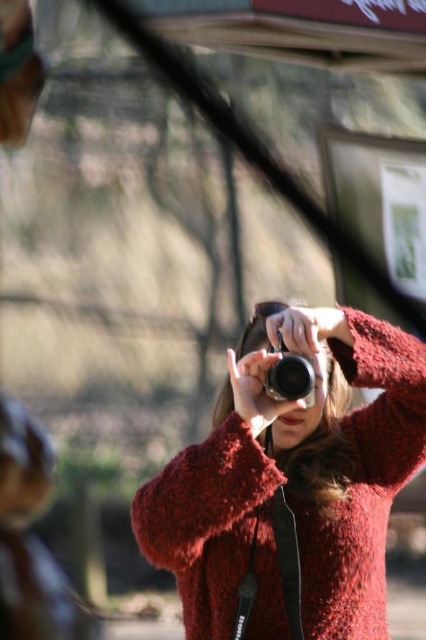
You are a photographer trying to adjust your camera settings. You notice the fuzzy red sweater at center and the matte black camera at center. Which object is located lower in the image?

The fuzzy red sweater at center is positioned under the matte black camera at center, so it is lower in the image.

You are a photographer trying to frame a shot. You notice the fuzzy red sweater at center is slightly off your desired composition. If you move your camera 0.1 units to the right along the x axis, will the sweater move to the right or left in your view?

Moving the camera to the right will cause the fuzzy red sweater at center to appear to move to the left in your view due to the principles of perspective and camera movement.